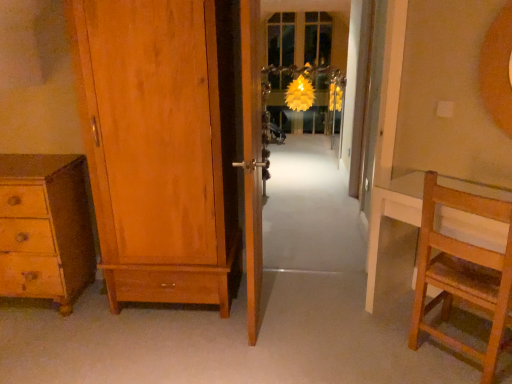
At what (x,y) coordinates should I click in order to perform the action: click on vacant space in between light brown wooden chair at right and wooden door at center, acting as the second door starting from the left. Please return your answer as a coordinate pair (x, y). This screenshot has height=384, width=512. Looking at the image, I should click on (338, 331).